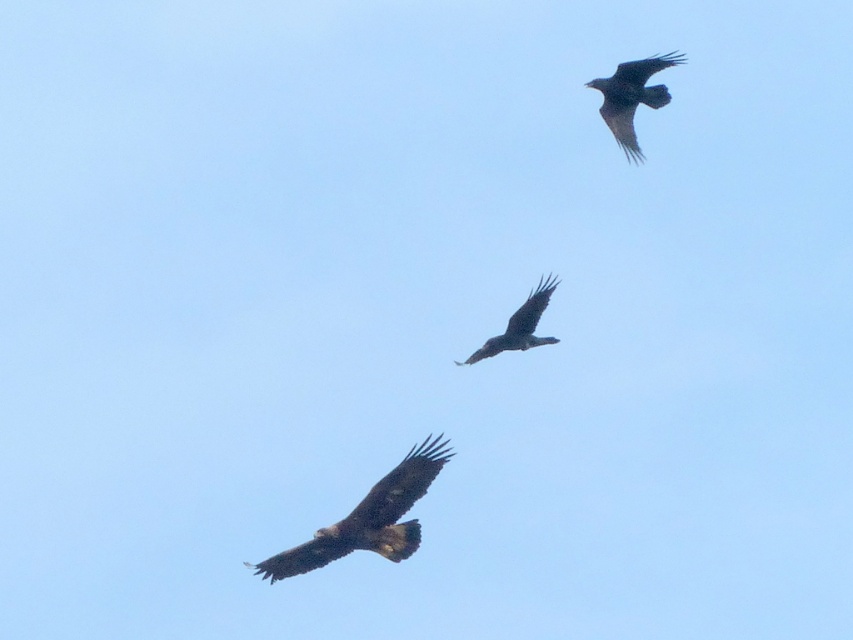
You are a birdwatcher observing the three birds in the sky. You notice two birds with dark brown feathers at upper right and dark brown feathers at center. Which of these two birds is positioned higher in the sky?

The dark brown feathers at upper right is positioned higher in the sky compared to the dark brown feathers at center because it has a greater height.

You are a birdwatcher trying to identify the birds in the sky. You notice two birds in the image. Which one is bigger? The brown feathered eagle at lower center and the dark brown feathers at upper right.

The brown feathered eagle at lower center is larger in size compared to the dark brown feathers at upper right.

You are a birdwatcher observing the scene. You notice the brown feathered eagle at lower center and the dark brown feathers at upper right. Which of these two birds has a larger wingspan?

The brown feathered eagle at lower center might have a larger wingspan than the dark brown feathers at upper right.